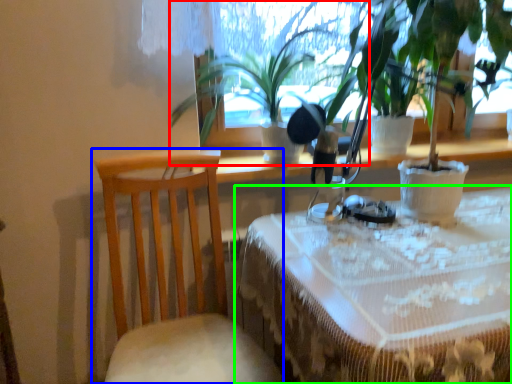
Question: Which object is the farthest from houseplant (highlighted by a red box)? Choose among these: chair (highlighted by a blue box) or table (highlighted by a green box).

Choices:
 (A) chair
 (B) table

Answer: (B)